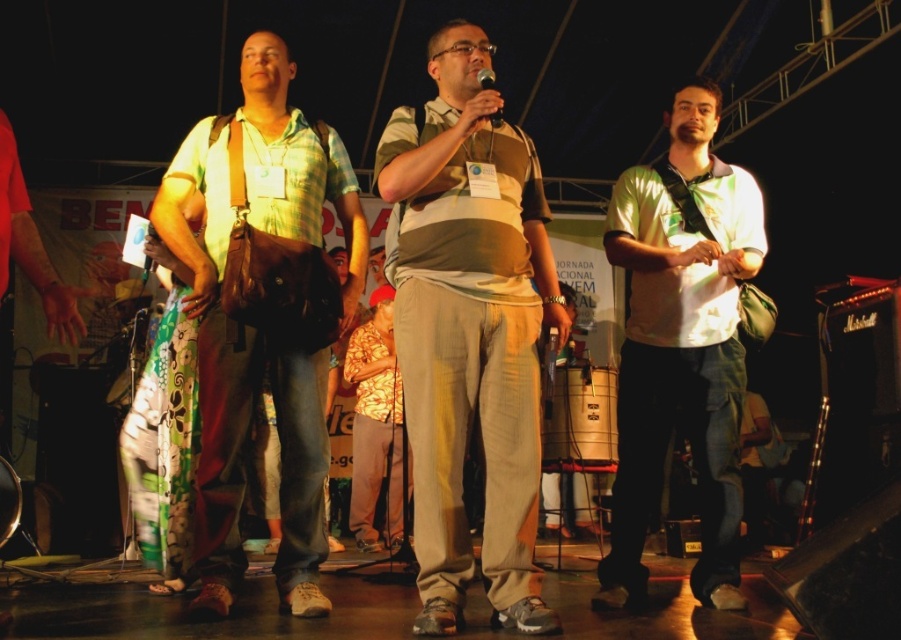
Question: Does matte beige pants at center have a lesser width compared to light green fabric shirt at center?

Choices:
 (A) yes
 (B) no

Answer: (A)

Question: Which point appears farthest from the camera in this image?

Choices:
 (A) (496, 125)
 (B) (417, 426)

Answer: (A)

Question: Which object is positioned farthest from the light green fabric shirt at center?

Choices:
 (A) matte brown bag at left
 (B) matte black microphone at center
 (C) matte beige pants at center

Answer: (A)

Question: Does matte beige pants at center have a smaller size compared to matte brown bag at left?

Choices:
 (A) yes
 (B) no

Answer: (A)

Question: Can you confirm if matte brown bag at left is smaller than matte black microphone at center?

Choices:
 (A) yes
 (B) no

Answer: (B)

Question: Based on their relative distances, which object is nearer to the matte beige pants at center?

Choices:
 (A) light green fabric shirt at center
 (B) matte brown bag at left
 (C) matte black microphone at center

Answer: (C)